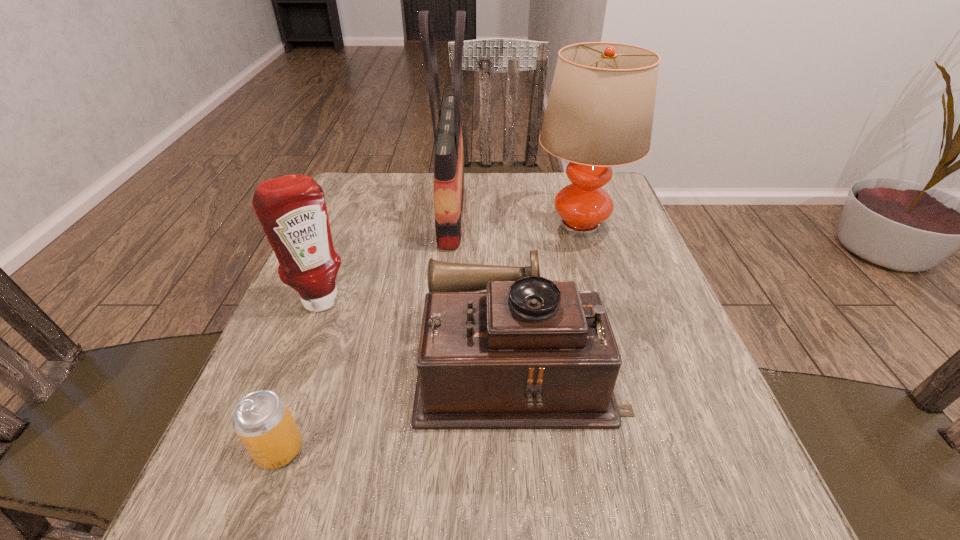
At what (x,y) coordinates should I click in order to perform the action: click on shopping bag. Please return your answer as a coordinate pair (x, y). Image resolution: width=960 pixels, height=540 pixels. Looking at the image, I should click on (449, 160).

Identify the location of lamp. pyautogui.click(x=599, y=114).

What are the coordinates of `condiment` in the screenshot? It's located at (292, 210).

Where is `the second shortest object`? the second shortest object is located at coordinates (529, 353).

Where is `the shortest object`? the shortest object is located at coordinates (262, 420).

I want to click on blank space located 0.280m on the front-facing side of the shopping bag, so click(576, 212).

Image resolution: width=960 pixels, height=540 pixels. In order to click on vacant space located 0.060m on the front of the lamp in this screenshot , I will do 593,272.

Locate an element on the screen. This screenshot has width=960, height=540. vacant space located on the back of the third shortest object is located at coordinates (340, 249).

Where is `vacant point located on the horn of the phonograph_record`? The height and width of the screenshot is (540, 960). vacant point located on the horn of the phonograph_record is located at coordinates (341, 364).

Where is `vacant space located 0.180m on the horn of the phonograph_record`? This screenshot has width=960, height=540. vacant space located 0.180m on the horn of the phonograph_record is located at coordinates pos(319,364).